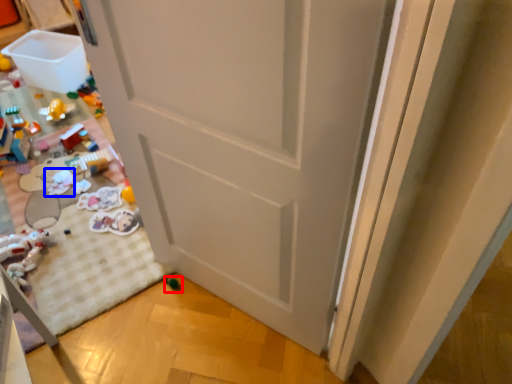
Question: Which object is closer to the camera taking this photo, toy (highlighted by a red box) or toy (highlighted by a blue box)?

Choices:
 (A) toy
 (B) toy

Answer: (A)